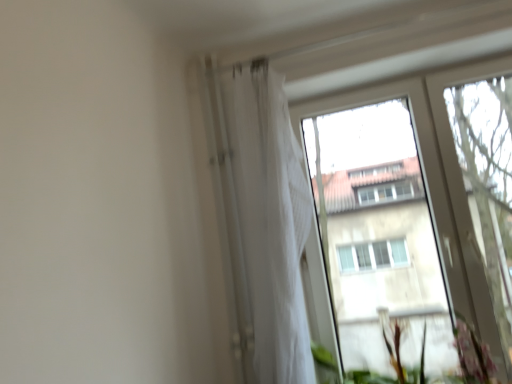
Question: Is white sheer curtain at upper center aimed at transparent glass tree at right?

Choices:
 (A) no
 (B) yes

Answer: (A)

Question: Is white sheer curtain at upper center in front of transparent glass tree at right?

Choices:
 (A) no
 (B) yes

Answer: (B)

Question: Is white sheer curtain at upper center not within transparent glass tree at right?

Choices:
 (A) yes
 (B) no

Answer: (A)

Question: Can you confirm if white sheer curtain at upper center is bigger than transparent glass tree at right?

Choices:
 (A) yes
 (B) no

Answer: (A)

Question: From a real-world perspective, is white sheer curtain at upper center located higher than transparent glass tree at right?

Choices:
 (A) no
 (B) yes

Answer: (B)

Question: From their relative heights in the image, would you say green leafy plant at lower right is taller or shorter than white sheer curtain at upper center?

Choices:
 (A) tall
 (B) short

Answer: (B)

Question: In terms of width, does green leafy plant at lower right look wider or thinner when compared to white sheer curtain at upper center?

Choices:
 (A) thin
 (B) wide

Answer: (B)

Question: From a real-world perspective, is green leafy plant at lower right positioned above or below white sheer curtain at upper center?

Choices:
 (A) below
 (B) above

Answer: (A)

Question: Does point (393, 347) appear closer or farther from the camera than point (257, 340)?

Choices:
 (A) closer
 (B) farther

Answer: (B)

Question: Considering the relative positions of transparent glass tree at right and white sheer curtain at upper center in the image provided, is transparent glass tree at right to the left or to the right of white sheer curtain at upper center?

Choices:
 (A) right
 (B) left

Answer: (A)

Question: From a real-world perspective, is transparent glass tree at right above or below white sheer curtain at upper center?

Choices:
 (A) above
 (B) below

Answer: (B)

Question: In terms of width, does transparent glass tree at right look wider or thinner when compared to white sheer curtain at upper center?

Choices:
 (A) wide
 (B) thin

Answer: (B)

Question: Considering their positions, is transparent glass tree at right located in front of or behind white sheer curtain at upper center?

Choices:
 (A) front
 (B) behind

Answer: (B)

Question: Looking at their shapes, would you say white sheer curtain at upper center is wider or thinner than transparent glass tree at right?

Choices:
 (A) thin
 (B) wide

Answer: (B)

Question: Looking at the image, does white sheer curtain at upper center seem bigger or smaller compared to transparent glass tree at right?

Choices:
 (A) big
 (B) small

Answer: (A)